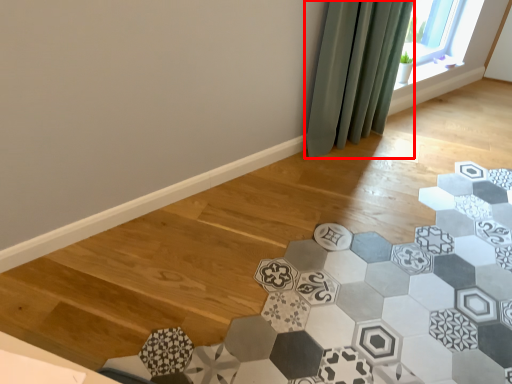
Question: From the image, what is the correct spatial relationship of curtain (annotated by the red box) in relation to ceramic tile?

Choices:
 (A) left
 (B) right

Answer: (B)